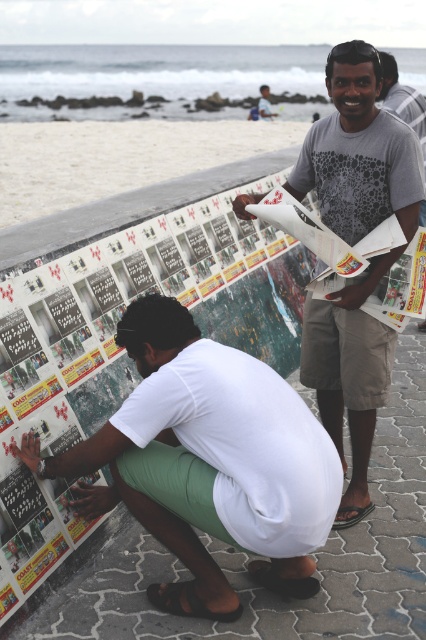
Which of these two, gray dotted t-shirt at upper center or matte gray t-shirt at center, stands taller?

matte gray t-shirt at center is taller.

Which is behind, point (322, 144) or point (276, 113)?

The point (276, 113) is behind.

Find the location of a particular element. Image resolution: width=426 pixels, height=640 pixels. gray dotted t-shirt at upper center is located at coordinates (359, 152).

Does white matte shirt at lower center have a larger size compared to matte gray t-shirt at center?

Actually, white matte shirt at lower center might be smaller than matte gray t-shirt at center.

Can you confirm if white matte shirt at lower center is positioned below matte gray t-shirt at center?

Yes, white matte shirt at lower center is below matte gray t-shirt at center.

At what (x,y) coordinates should I click in order to perform the action: click on white matte shirt at lower center. Please return your answer as a coordinate pair (x, y). Looking at the image, I should click on (207, 461).

This screenshot has width=426, height=640. Find the location of `white matte shirt at lower center`. white matte shirt at lower center is located at coordinates (207, 461).

This screenshot has height=640, width=426. Describe the element at coordinates (207, 461) in the screenshot. I see `white matte shirt at lower center` at that location.

Can you confirm if white matte shirt at lower center is shorter than gray dotted t-shirt at upper center?

Indeed, white matte shirt at lower center has a lesser height compared to gray dotted t-shirt at upper center.

The image size is (426, 640). What do you see at coordinates (207, 461) in the screenshot?
I see `white matte shirt at lower center` at bounding box center [207, 461].

Where is `white matte shirt at lower center`? This screenshot has width=426, height=640. white matte shirt at lower center is located at coordinates pyautogui.click(x=207, y=461).